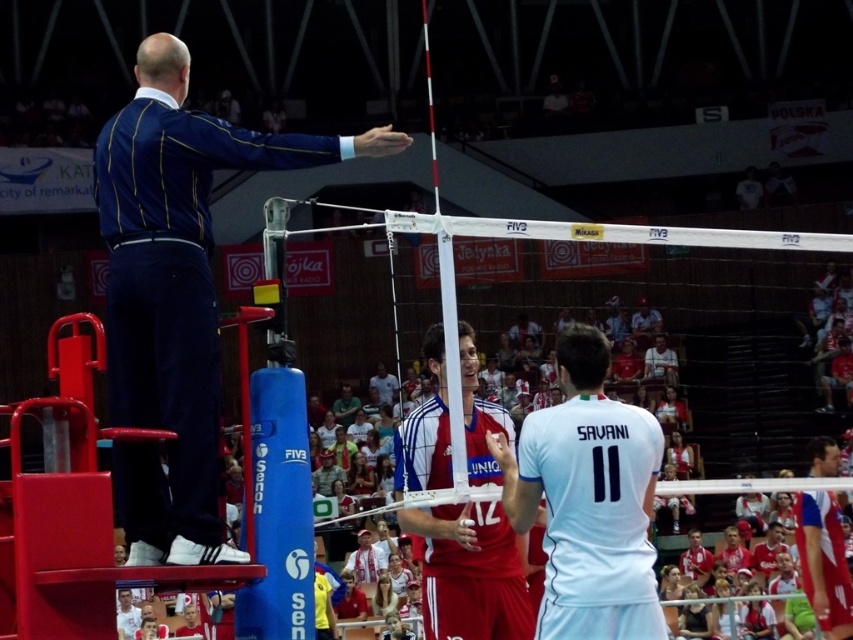
Question: Which of the following is the farthest from the observer?

Choices:
 (A) (370, 147)
 (B) (569, 493)
 (C) (459, 349)

Answer: (C)

Question: Can you confirm if blue striped suit at upper left is wider than white jersey at center?

Choices:
 (A) no
 (B) yes

Answer: (B)

Question: Which point is closer to the camera?

Choices:
 (A) (109, 296)
 (B) (486, 408)
 (C) (622, 467)

Answer: (A)

Question: Estimate the real-world distances between objects in this image. Which object is closer to the white jersey at center?

Choices:
 (A) blue striped suit at upper left
 (B) red jersey at center

Answer: (B)

Question: Does blue striped suit at upper left have a greater width compared to white jersey at center?

Choices:
 (A) no
 (B) yes

Answer: (B)

Question: Is white jersey at center above red jersey at center?

Choices:
 (A) yes
 (B) no

Answer: (A)